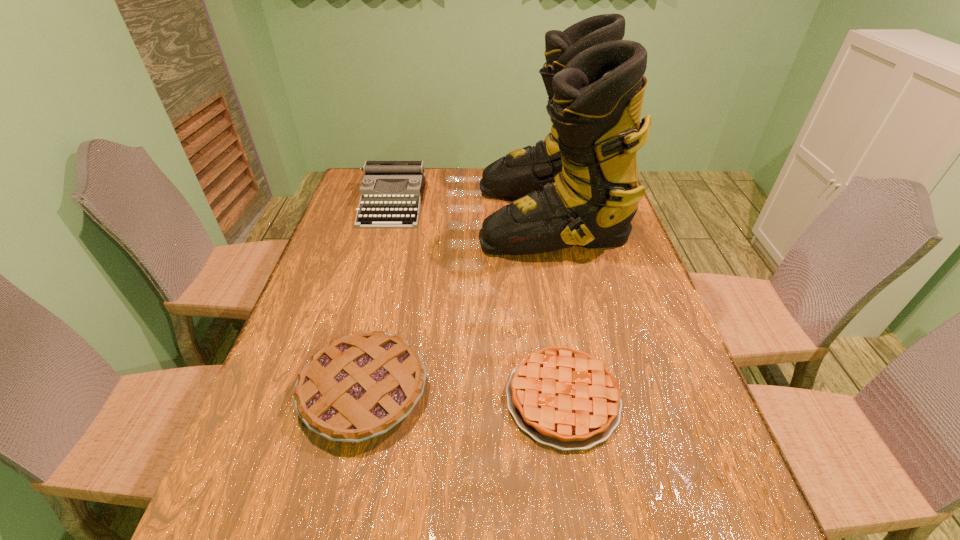
Locate an element on the screen. vacant area that lies between the shorter pie and the third shortest object is located at coordinates (478, 301).

Where is `free space that is in between the shorter pie and the typewriter`? The width and height of the screenshot is (960, 540). free space that is in between the shorter pie and the typewriter is located at coordinates (478, 301).

At what (x,y) coordinates should I click in order to perform the action: click on empty space between the typewriter and the ski boots. Please return your answer as a coordinate pair (x, y). The width and height of the screenshot is (960, 540). Looking at the image, I should click on (471, 210).

What are the coordinates of `vacant space that is in between the tallest object and the typewriter` in the screenshot? It's located at [x=471, y=210].

At what (x,y) coordinates should I click in order to perform the action: click on free space between the ski boots and the second tallest object. Please return your answer as a coordinate pair (x, y). The width and height of the screenshot is (960, 540). Looking at the image, I should click on (471, 210).

In order to click on free space between the second tallest object and the right pie in this screenshot , I will do `click(478, 301)`.

Identify the location of free point between the shortest object and the typewriter. (478, 301).

The width and height of the screenshot is (960, 540). In order to click on unoccupied area between the ski boots and the left pie in this screenshot , I will do `click(457, 303)`.

Identify the location of empty space that is in between the typewriter and the taller pie. The height and width of the screenshot is (540, 960). (378, 298).

Find the location of a particular element. Image resolution: width=960 pixels, height=540 pixels. free area in between the ski boots and the third shortest object is located at coordinates (471, 210).